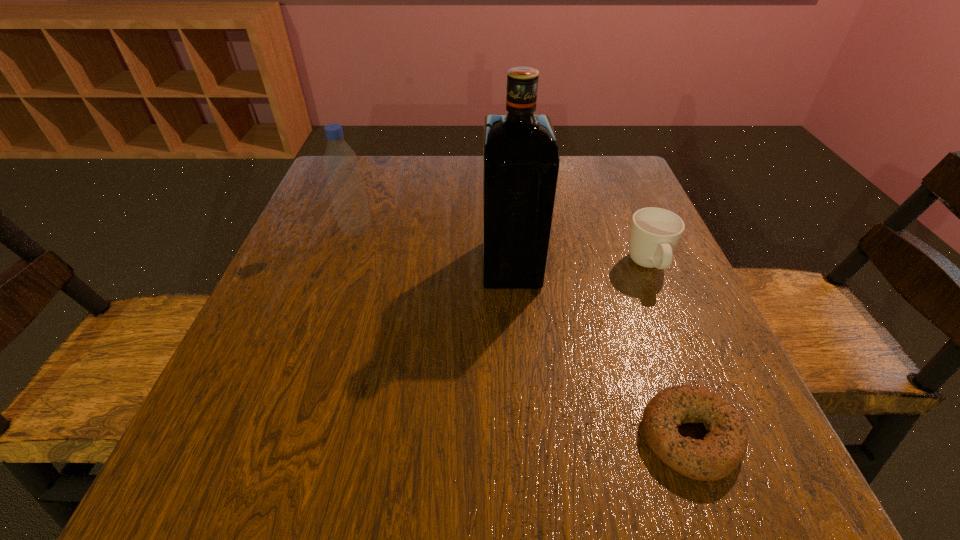
Find the location of `vacant space at the left edge of the desktop`. vacant space at the left edge of the desktop is located at coordinates (365, 261).

Find the location of a particular element. vacant area at the right edge is located at coordinates (644, 289).

Locate an element on the screen. vacant region at the far left corner is located at coordinates (366, 178).

Identify the location of free space at the near left corner of the desktop. (182, 481).

Locate an element on the screen. vacant space at the far right corner of the desktop is located at coordinates (618, 180).

This screenshot has height=540, width=960. I want to click on vacant area between the third tallest object and the shortest object, so click(x=669, y=352).

Image resolution: width=960 pixels, height=540 pixels. Find the location of `vacant space in between the farthest object and the shortest object`. vacant space in between the farthest object and the shortest object is located at coordinates (523, 333).

At what (x,y) coordinates should I click in order to perform the action: click on free spot between the liquor and the shortest object. Please return your answer as a coordinate pair (x, y). The width and height of the screenshot is (960, 540). Looking at the image, I should click on (601, 350).

Locate an element on the screen. This screenshot has width=960, height=540. free space between the liquor and the leftmost object is located at coordinates (434, 247).

At what (x,y) coordinates should I click in order to perform the action: click on vacant space in between the tallest object and the second tallest object. Please return your answer as a coordinate pair (x, y). Looking at the image, I should click on (434, 247).